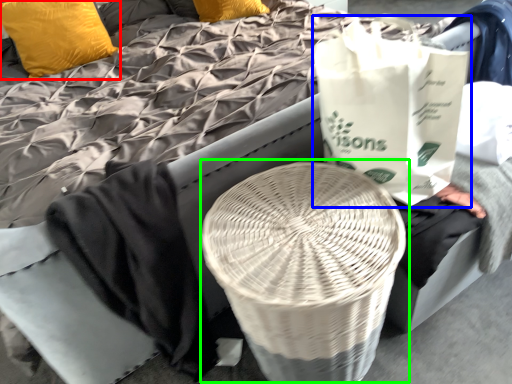
Question: Estimate the real-world distances between objects in this image. Which object is farther from pillow (highlighted by a red box), grocery bag (highlighted by a blue box) or round table (highlighted by a green box)?

Choices:
 (A) grocery bag
 (B) round table

Answer: (B)